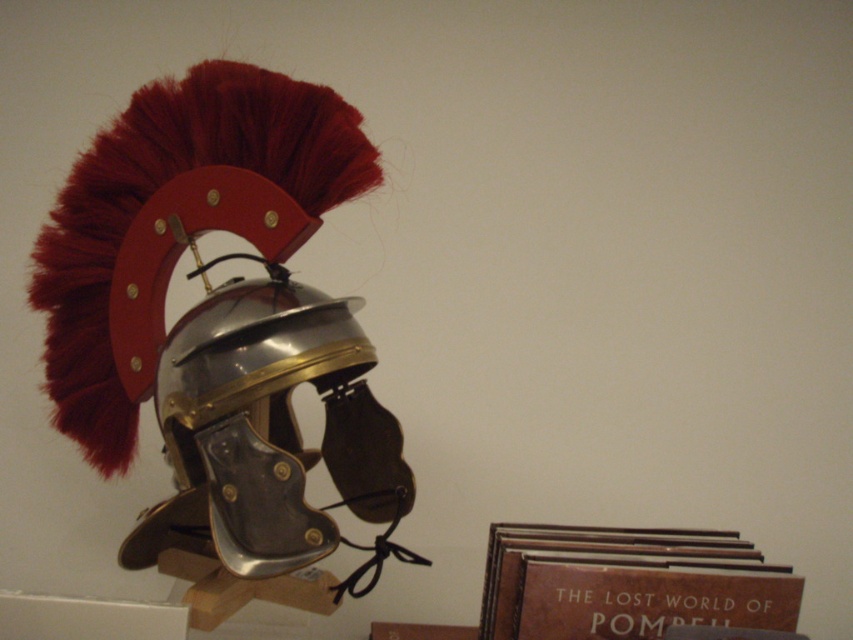
Question: Which of the following is the farthest from the observer?

Choices:
 (A) brown leather book at lower right
 (B) metallic silver helmet at center

Answer: (A)

Question: Is metallic silver helmet at center to the right of brown leather book at lower right from the viewer's perspective?

Choices:
 (A) no
 (B) yes

Answer: (A)

Question: Observing the image, what is the correct spatial positioning of metallic silver helmet at center in reference to brown leather book at lower right?

Choices:
 (A) right
 (B) left

Answer: (B)

Question: Is metallic silver helmet at center thinner than brown leather book at lower right?

Choices:
 (A) no
 (B) yes

Answer: (A)

Question: Which point is farther to the camera?

Choices:
 (A) (505, 552)
 (B) (227, 364)

Answer: (A)